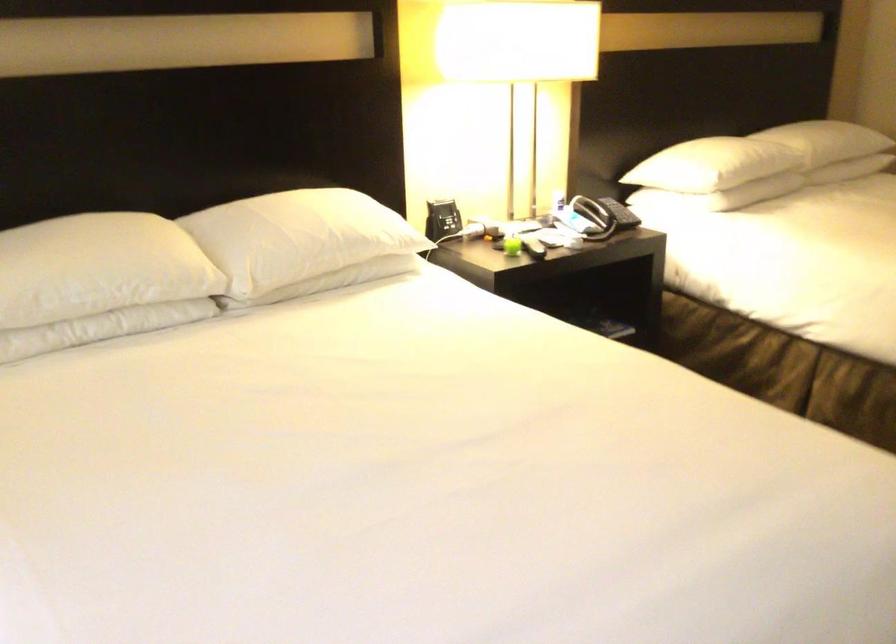
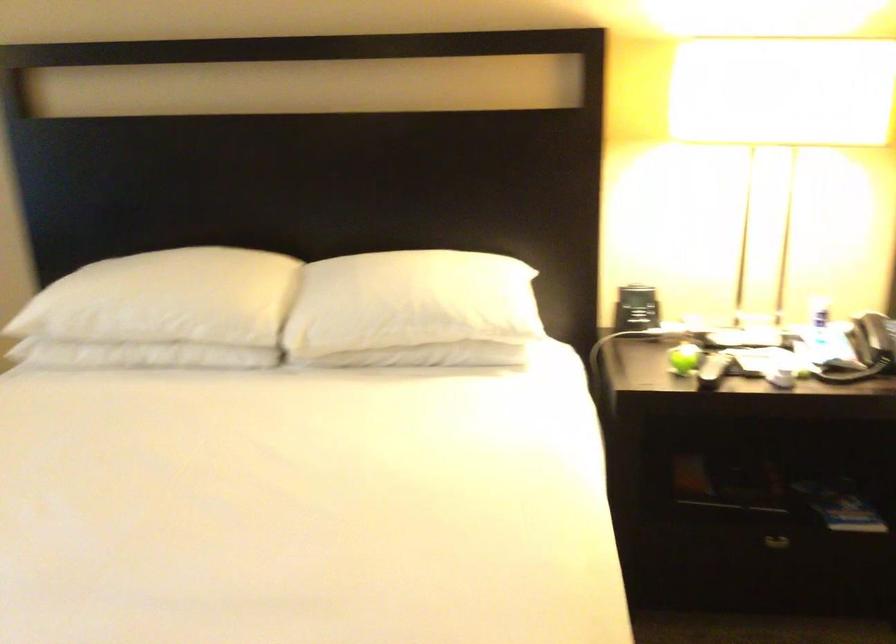
In the second image, find the point that corresponds to [300,238] in the first image.

(382, 303)